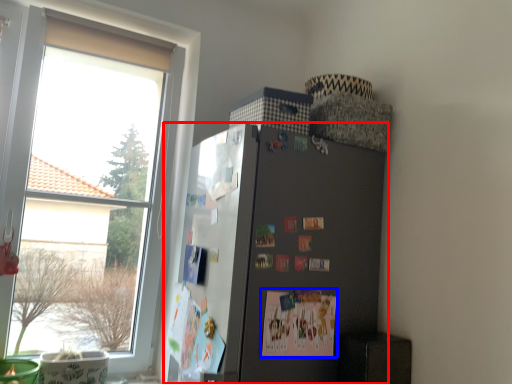
Question: Which of the following is the closest to the observer, refrigerator (highlighted by a red box) or postcard (highlighted by a blue box)?

Choices:
 (A) refrigerator
 (B) postcard

Answer: (A)